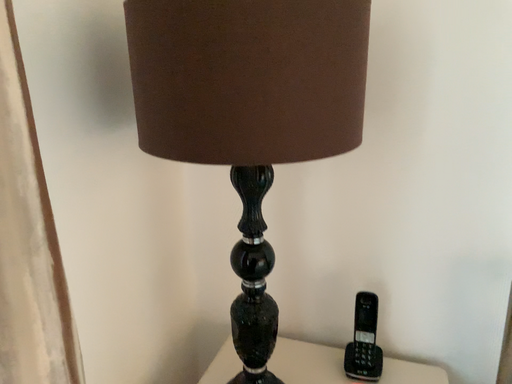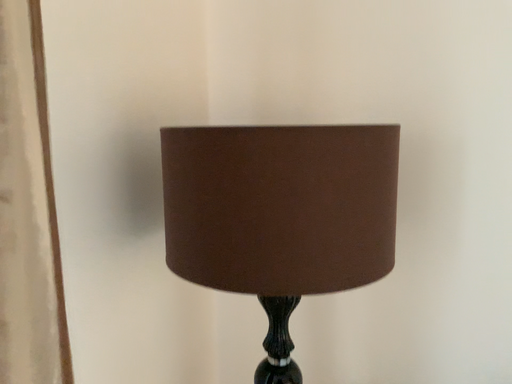
Question: Which way did the camera rotate in the video?

Choices:
 (A) rotated upward
 (B) rotated downward

Answer: (A)